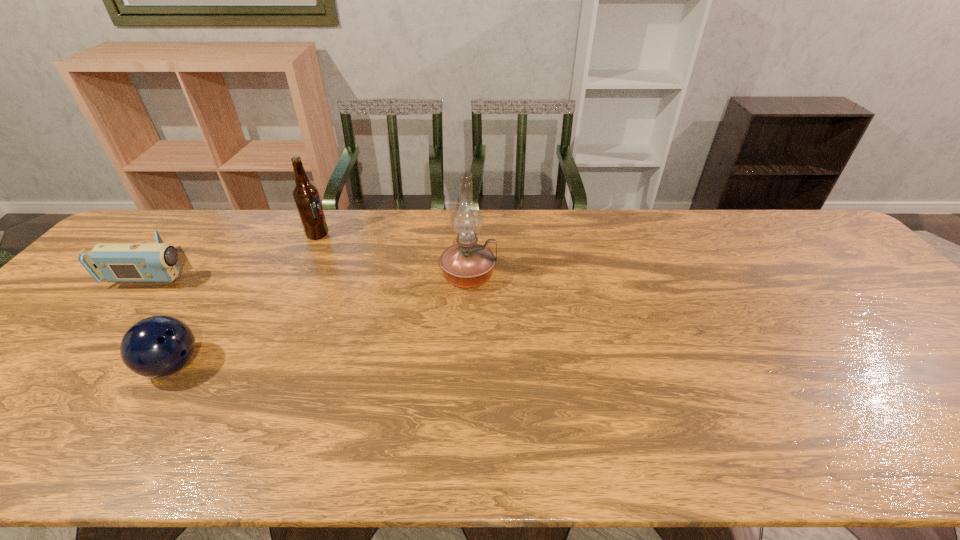
The height and width of the screenshot is (540, 960). What are the coordinates of `free spot between the tallest object and the camcorder` in the screenshot? It's located at (314, 272).

The width and height of the screenshot is (960, 540). In order to click on unoccupied area between the tallest object and the bowling ball in this screenshot , I will do `click(321, 320)`.

Find the location of a particular element. unoccupied area between the oil lamp and the leftmost object is located at coordinates (314, 272).

Locate an element on the screen. free spot between the tallest object and the bowling ball is located at coordinates (321, 320).

Locate an element on the screen. This screenshot has height=540, width=960. empty space between the leftmost object and the beer bottle is located at coordinates (238, 252).

At what (x,y) coordinates should I click in order to perform the action: click on vacant area that lies between the leftmost object and the farthest object. Please return your answer as a coordinate pair (x, y). This screenshot has height=540, width=960. Looking at the image, I should click on (238, 252).

Where is `the second closest object relative to the nearest object`? This screenshot has width=960, height=540. the second closest object relative to the nearest object is located at coordinates coord(306,196).

Where is `the second closest object to the camcorder`? This screenshot has width=960, height=540. the second closest object to the camcorder is located at coordinates (306, 196).

This screenshot has height=540, width=960. Find the location of `free space that satisfies the following two spatial constraints: 1. on the side of the leftmost object with the flip-out screen; 2. on the back side of the rightmost object`. free space that satisfies the following two spatial constraints: 1. on the side of the leftmost object with the flip-out screen; 2. on the back side of the rightmost object is located at coordinates (155, 275).

You are a GUI agent. You are given a task and a screenshot of the screen. Output one action in this format:
    pyautogui.click(x=<x>, y=<y>)
    Task: Click on the free spot that satisfies the following two spatial constraints: 1. on the back side of the tallest object; 2. on the label of the beer bottle
    This screenshot has height=540, width=960.
    Given the screenshot: What is the action you would take?
    pyautogui.click(x=469, y=235)